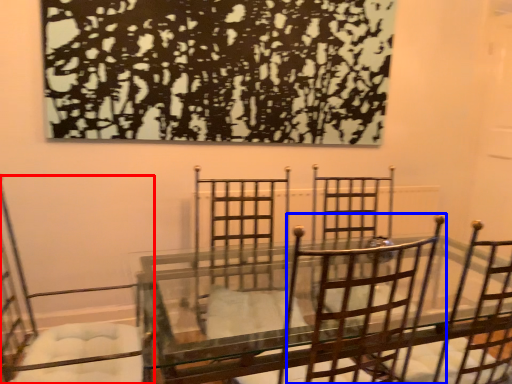
Question: Which object is further to the camera taking this photo, chair (highlighted by a red box) or chair (highlighted by a blue box)?

Choices:
 (A) chair
 (B) chair

Answer: (A)